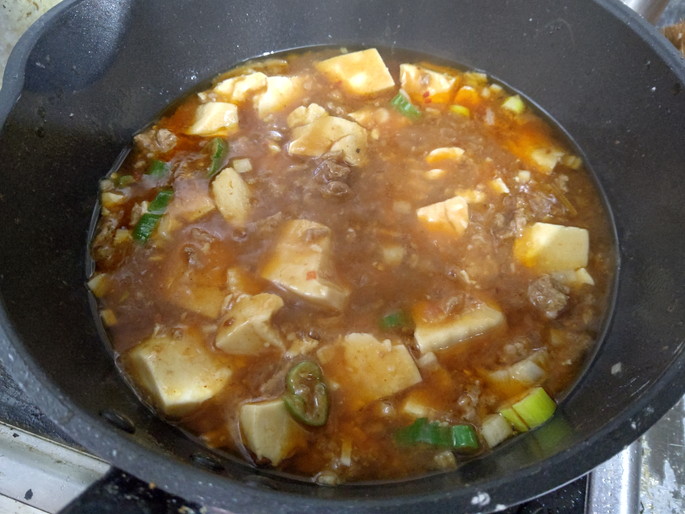
Locate an element on the screen. This screenshot has height=514, width=685. gas cooker is located at coordinates (25, 498).